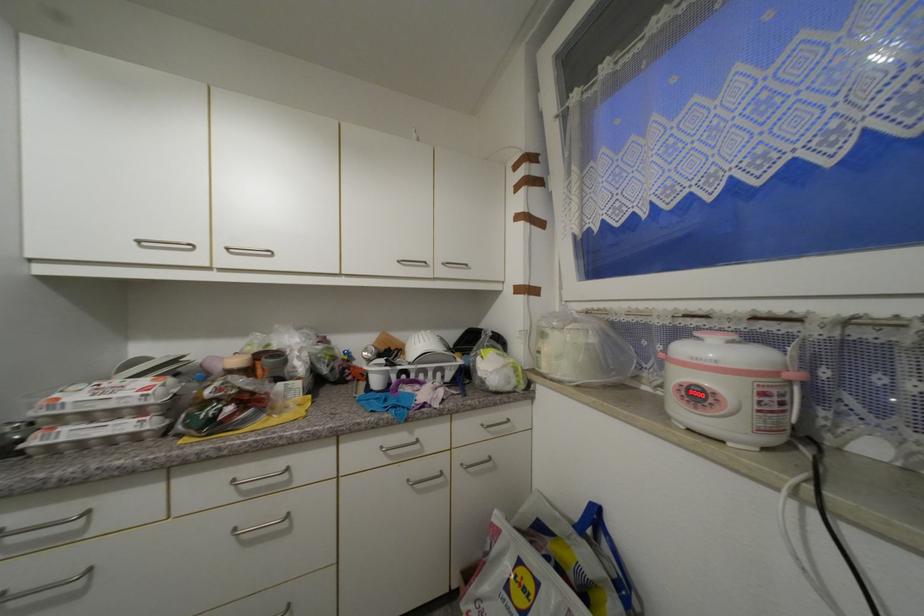
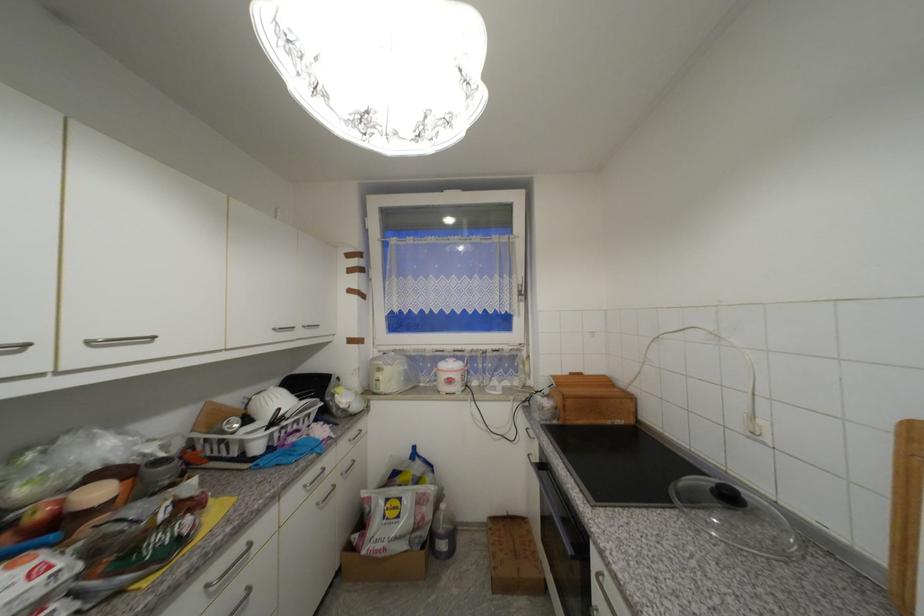
Find the pixel in the second image that matches pixel 238 483 in the first image.

(213, 588)